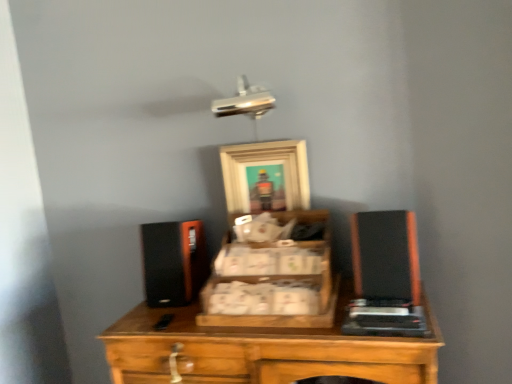
Question: From the image's perspective, is wooden crate at center under wooden picture frame at center?

Choices:
 (A) no
 (B) yes

Answer: (B)

Question: From the image's perspective, is wooden crate at center above wooden picture frame at center?

Choices:
 (A) yes
 (B) no

Answer: (B)

Question: Is wooden picture frame at center a part of wooden crate at center?

Choices:
 (A) yes
 (B) no

Answer: (B)

Question: Is wooden crate at center at the left side of wooden picture frame at center?

Choices:
 (A) no
 (B) yes

Answer: (A)

Question: Is wooden crate at center positioned far away from wooden picture frame at center?

Choices:
 (A) yes
 (B) no

Answer: (B)

Question: Looking at the image, does wooden picture frame at center seem bigger or smaller compared to black matte speaker at right?

Choices:
 (A) big
 (B) small

Answer: (B)

Question: Is wooden picture frame at center wider or thinner than black matte speaker at right?

Choices:
 (A) wide
 (B) thin

Answer: (B)

Question: Considering their positions, is wooden picture frame at center located in front of or behind black matte speaker at right?

Choices:
 (A) behind
 (B) front

Answer: (A)

Question: Considering the positions of point (265, 142) and point (411, 213), is point (265, 142) closer or farther from the camera than point (411, 213)?

Choices:
 (A) closer
 (B) farther

Answer: (B)

Question: Considering the relative positions of wooden crate at center and wooden picture frame at center in the image provided, is wooden crate at center to the left or to the right of wooden picture frame at center?

Choices:
 (A) right
 (B) left

Answer: (A)

Question: Is wooden crate at center inside the boundaries of wooden picture frame at center, or outside?

Choices:
 (A) inside
 (B) outside

Answer: (B)

Question: Is wooden crate at center wider or thinner than wooden picture frame at center?

Choices:
 (A) wide
 (B) thin

Answer: (A)

Question: In terms of height, does wooden crate at center look taller or shorter compared to wooden picture frame at center?

Choices:
 (A) tall
 (B) short

Answer: (B)

Question: Is wooden crate at center wider or thinner than black matte speaker at right?

Choices:
 (A) thin
 (B) wide

Answer: (B)

Question: Is point coord(244,249) positioned closer to the camera than point coord(396,271)?

Choices:
 (A) closer
 (B) farther

Answer: (B)